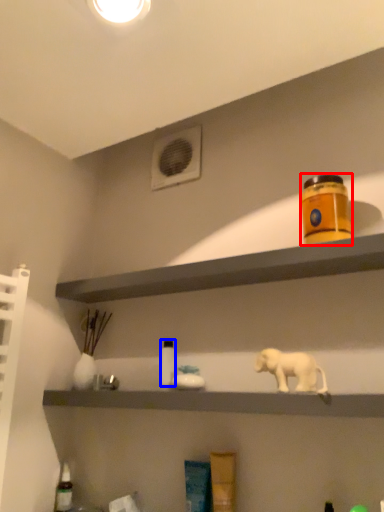
Question: Which of the following is the closest to the observer, product (highlighted by a red box) or bottle (highlighted by a blue box)?

Choices:
 (A) product
 (B) bottle

Answer: (A)